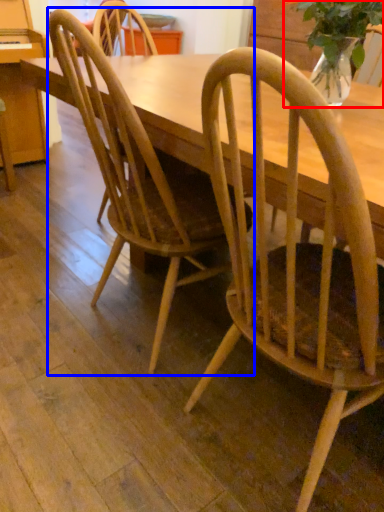
Question: Among these objects, which one is farthest to the camera, houseplant (highlighted by a red box) or chair (highlighted by a blue box)?

Choices:
 (A) houseplant
 (B) chair

Answer: (A)